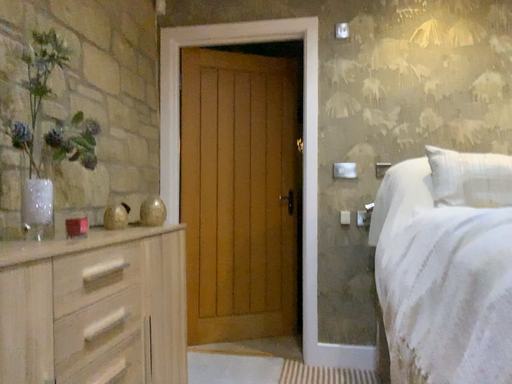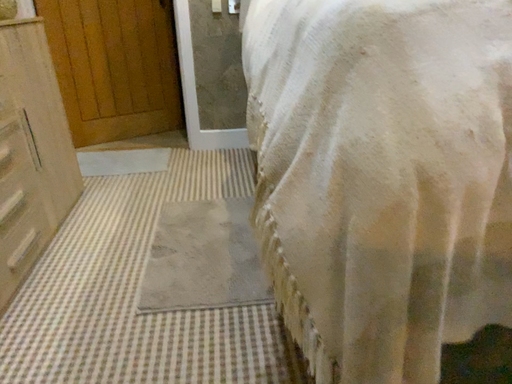
Question: How did the camera likely rotate when shooting the video?

Choices:
 (A) rotated downward
 (B) rotated upward

Answer: (A)